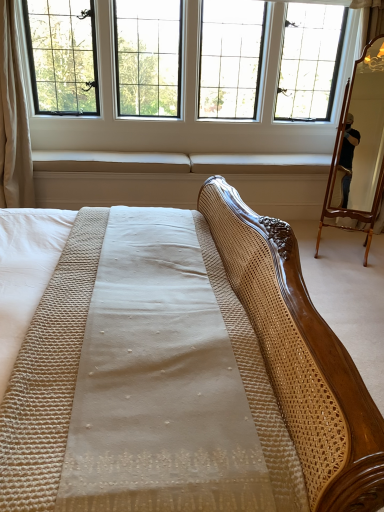
Question: Considering the positions of white fabric curtain at left and wooden mirror at right in the image, is white fabric curtain at left wider or thinner than wooden mirror at right?

Choices:
 (A) thin
 (B) wide

Answer: (B)

Question: In the image, is white fabric curtain at left on the left side or the right side of wooden mirror at right?

Choices:
 (A) right
 (B) left

Answer: (B)

Question: Based on their relative distances, which object is farther from the wooden mirror at right?

Choices:
 (A) clear glass window at upper center
 (B) white fabric curtain at left

Answer: (B)

Question: Estimate the real-world distances between objects in this image. Which object is closer to the white fabric curtain at left?

Choices:
 (A) clear glass window at upper center
 (B) wooden mirror at right

Answer: (A)